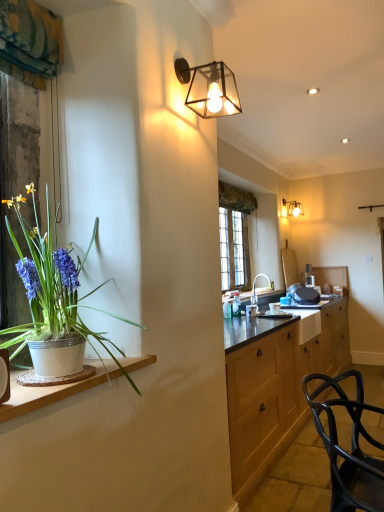
Question: Is matte glass wall sconce at upper right, acting as the second lamp starting from the front, with white ceramic pot at left?

Choices:
 (A) no
 (B) yes

Answer: (A)

Question: From a real-world perspective, is matte glass wall sconce at upper right, the 1th lamp from the right, beneath white ceramic pot at left?

Choices:
 (A) yes
 (B) no

Answer: (B)

Question: Is matte glass wall sconce at upper right, which is counted as the second lamp, starting from the left, at the right side of white ceramic pot at left?

Choices:
 (A) yes
 (B) no

Answer: (A)

Question: Is matte glass wall sconce at upper right, which is counted as the second lamp, starting from the left, thinner than white ceramic pot at left?

Choices:
 (A) yes
 (B) no

Answer: (A)

Question: From the image's perspective, is matte glass wall sconce at upper right, which is counted as the second lamp, starting from the left, under white ceramic pot at left?

Choices:
 (A) yes
 (B) no

Answer: (B)

Question: From their relative heights in the image, would you say white ceramic sink at center is taller or shorter than white ceramic pot at left?

Choices:
 (A) short
 (B) tall

Answer: (B)

Question: From a real-world perspective, is white ceramic sink at center positioned above or below white ceramic pot at left?

Choices:
 (A) below
 (B) above

Answer: (B)

Question: In the image, is white ceramic sink at center on the left side or the right side of white ceramic pot at left?

Choices:
 (A) left
 (B) right

Answer: (B)

Question: Looking at their shapes, would you say white ceramic sink at center is wider or thinner than white ceramic pot at left?

Choices:
 (A) thin
 (B) wide

Answer: (A)

Question: From the image's perspective, is white ceramic sink at center located above or below matte glass lamp at upper center, the 1th lamp from the left?

Choices:
 (A) above
 (B) below

Answer: (B)

Question: Is white ceramic sink at center inside the boundaries of matte glass lamp at upper center, the 1th lamp from the left, or outside?

Choices:
 (A) inside
 (B) outside

Answer: (B)

Question: Is white ceramic sink at center in front of or behind matte glass lamp at upper center, placed as the 1th lamp when sorted from front to back, in the image?

Choices:
 (A) behind
 (B) front

Answer: (A)

Question: From their relative heights in the image, would you say white ceramic sink at center is taller or shorter than matte glass lamp at upper center, placed as the 2th lamp when sorted from back to front?

Choices:
 (A) short
 (B) tall

Answer: (B)

Question: Is matte glass wall sconce at upper right, the 1th lamp from the right, situated inside white ceramic pot at left or outside?

Choices:
 (A) outside
 (B) inside

Answer: (A)

Question: Relative to white ceramic pot at left, is matte glass wall sconce at upper right, the 1th lamp from the right, in front or behind?

Choices:
 (A) behind
 (B) front

Answer: (A)